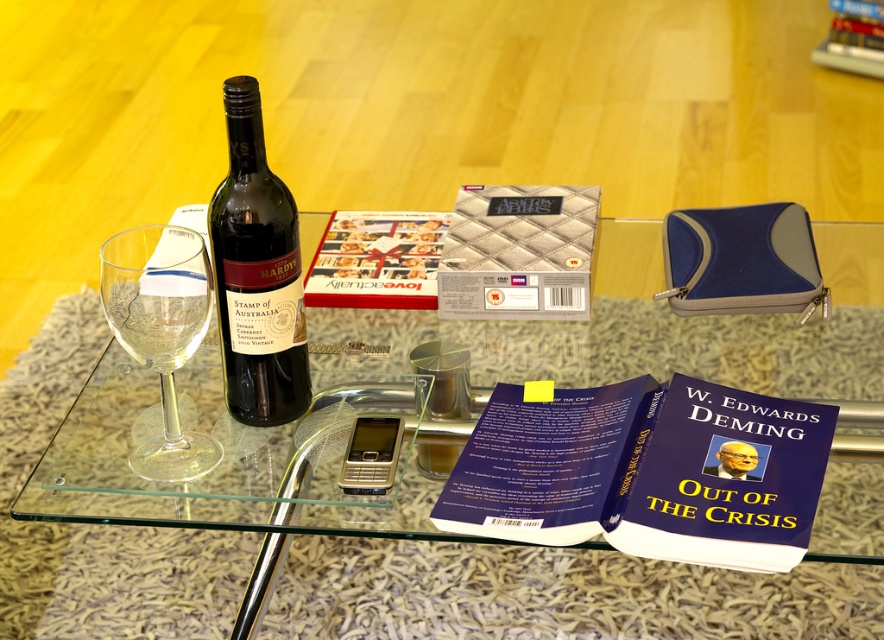
You are organizing items on the transparent glass table at center and need to place the blue hardcover book at center. How much space is there between them?

The transparent glass table at center and blue hardcover book at center are 4.46 inches apart.

You are organizing items on the coffee table and need to place a new item between the transparent glass wine glass at left and the hardcover book at center. Is there enough space between them for a standard notebook?

The transparent glass wine glass at left is to the left of the hardcover book at center, so there is space between them. A standard notebook can be placed between the transparent glass wine glass at left and the hardcover book at center.

You are a guest at a dinner party and notice the transparent glass wine glass at left and the hardcover book at center on the coffee table. Which item is positioned lower relative to the other?

The transparent glass wine glass at left is located below the hardcover book at center, so it is positioned lower.